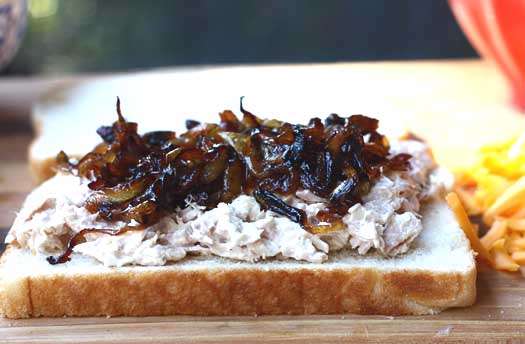
Locate an element on the screen. wood table or counter top is located at coordinates (375, 329).